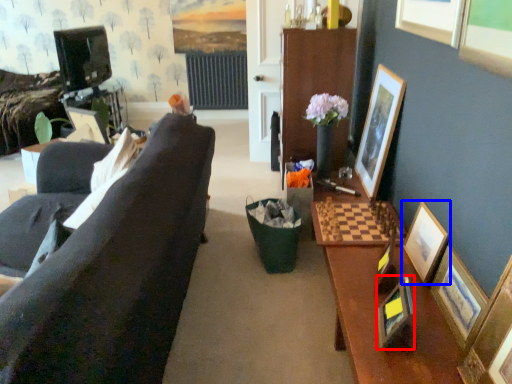
Question: Which of the following is the closest to the observer, picture frame (highlighted by a red box) or picture frame (highlighted by a blue box)?

Choices:
 (A) picture frame
 (B) picture frame

Answer: (A)